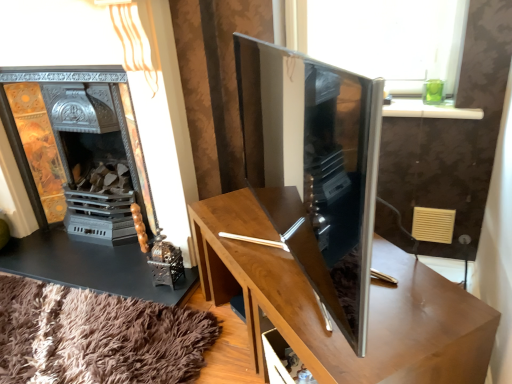
This screenshot has width=512, height=384. What do you see at coordinates (333, 322) in the screenshot?
I see `wooden table at center` at bounding box center [333, 322].

This screenshot has height=384, width=512. I want to click on metallic ornate fireplace at left, so click(x=86, y=150).

Describe the element at coordinates (86, 150) in the screenshot. The width and height of the screenshot is (512, 384). I see `metallic ornate fireplace at left` at that location.

Find the location of `wooden table at center`. wooden table at center is located at coordinates (333, 322).

From the image's perspective, which object appears higher, satin wood tv cabinet at center or wooden table at center?

satin wood tv cabinet at center, from the image's perspective.

Does point (346, 228) appear closer or farther from the camera than point (409, 340)?

Point (346, 228) is closer to the camera than point (409, 340).

Can you tell me how much satin wood tv cabinet at center and wooden table at center differ in facing direction?

16.5 degrees.

Is satin wood tv cabinet at center turned away from wooden table at center?

No, satin wood tv cabinet at center's orientation is not away from wooden table at center.

Considering the relative sizes of metallic ornate fireplace at left and satin wood tv cabinet at center in the image provided, is metallic ornate fireplace at left shorter than satin wood tv cabinet at center?

No, metallic ornate fireplace at left is not shorter than satin wood tv cabinet at center.

In the image, is metallic ornate fireplace at left on the left side or the right side of satin wood tv cabinet at center?

In the image, metallic ornate fireplace at left appears on the left side of satin wood tv cabinet at center.

Which of these two, metallic ornate fireplace at left or satin wood tv cabinet at center, is smaller?

satin wood tv cabinet at center is smaller.

Is satin wood tv cabinet at center a part of metallic ornate fireplace at left?

That's incorrect, satin wood tv cabinet at center is not inside metallic ornate fireplace at left.

Looking at this image, which object is thinner, wooden table at center or metallic ornate fireplace at left?

Thinner between the two is metallic ornate fireplace at left.

Is wooden table at center facing towards metallic ornate fireplace at left?

No, wooden table at center is not oriented towards metallic ornate fireplace at left.

Looking at this image, from the image's perspective, which one is positioned higher, wooden table at center or metallic ornate fireplace at left?

From the image's view, metallic ornate fireplace at left is above.

Identify the location of table below the metallic ornate fireplace at left (from a real-world perspective). (333, 322).

Is satin wood tv cabinet at center aimed at metallic ornate fireplace at left?

No, satin wood tv cabinet at center is not oriented towards metallic ornate fireplace at left.

Which object is thinner, satin wood tv cabinet at center or metallic ornate fireplace at left?

satin wood tv cabinet at center.

Locate an element on the screen. The height and width of the screenshot is (384, 512). tv cabinet on the right of metallic ornate fireplace at left is located at coordinates (315, 168).

From the image's perspective, is satin wood tv cabinet at center on top of metallic ornate fireplace at left?

No, from the image's perspective, satin wood tv cabinet at center is not above metallic ornate fireplace at left.

Which is correct: wooden table at center is inside satin wood tv cabinet at center, or outside of it?

The correct answer is: outside.

How many degrees apart are the facing directions of wooden table at center and satin wood tv cabinet at center?

They differ by 16.5 degrees in their facing directions.

Is wooden table at center bigger than satin wood tv cabinet at center?

Correct, wooden table at center is larger in size than satin wood tv cabinet at center.

From the picture: Does metallic ornate fireplace at left have a lesser width compared to wooden table at center?

Indeed, metallic ornate fireplace at left has a lesser width compared to wooden table at center.

Does metallic ornate fireplace at left turn towards wooden table at center?

No, metallic ornate fireplace at left is not turned towards wooden table at center.

From the image's perspective, would you say metallic ornate fireplace at left is positioned over wooden table at center?

Yes, from the image's perspective, metallic ornate fireplace at left is above wooden table at center.

Considering the relative sizes of metallic ornate fireplace at left and wooden table at center in the image provided, is metallic ornate fireplace at left taller than wooden table at center?

Indeed, metallic ornate fireplace at left has a greater height compared to wooden table at center.

Identify the location of table located on the right of satin wood tv cabinet at center. The width and height of the screenshot is (512, 384). (333, 322).

Image resolution: width=512 pixels, height=384 pixels. I want to click on fireplace on the left of the satin wood tv cabinet at center, so click(x=86, y=150).

When comparing their distances from wooden table at center, does satin wood tv cabinet at center or metallic ornate fireplace at left seem closer?

satin wood tv cabinet at center is closer to wooden table at center.

Looking at the image, which one is located closer to metallic ornate fireplace at left, wooden table at center or satin wood tv cabinet at center?

Among the two, wooden table at center is located nearer to metallic ornate fireplace at left.

Looking at the image, which one is located further to wooden table at center, metallic ornate fireplace at left or satin wood tv cabinet at center?

metallic ornate fireplace at left lies further to wooden table at center than the other object.

Which object lies nearer to the anchor point satin wood tv cabinet at center, wooden table at center or metallic ornate fireplace at left?

Among the two, wooden table at center is located nearer to satin wood tv cabinet at center.

From the image, which object appears to be nearer to satin wood tv cabinet at center, metallic ornate fireplace at left or wooden table at center?

wooden table at center is positioned closer to the anchor satin wood tv cabinet at center.

From the image, which object appears to be nearer to metallic ornate fireplace at left, satin wood tv cabinet at center or wooden table at center?

wooden table at center lies closer to metallic ornate fireplace at left than the other object.

This screenshot has height=384, width=512. Find the location of `table located between satin wood tv cabinet at center and metallic ornate fireplace at left in the depth direction`. table located between satin wood tv cabinet at center and metallic ornate fireplace at left in the depth direction is located at coordinates [333, 322].